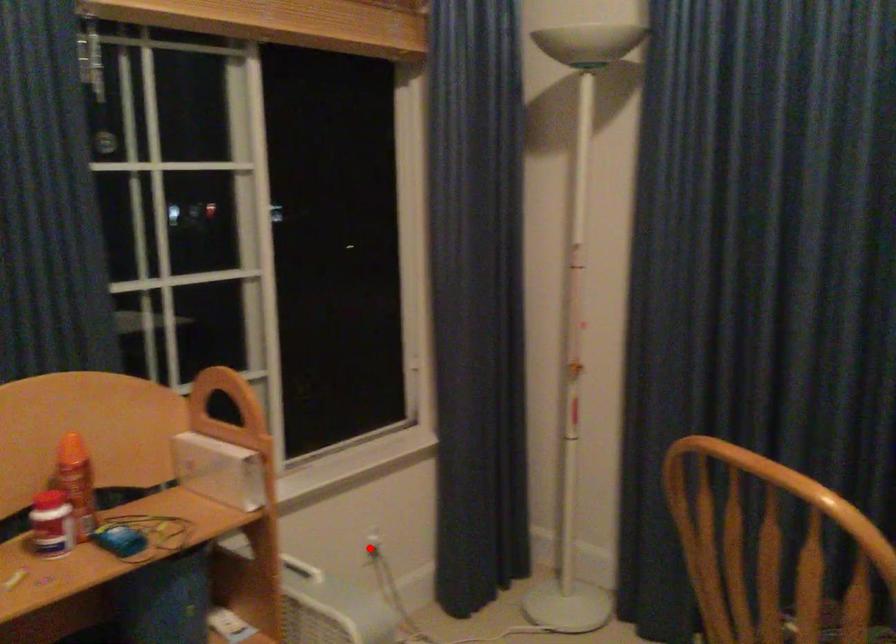
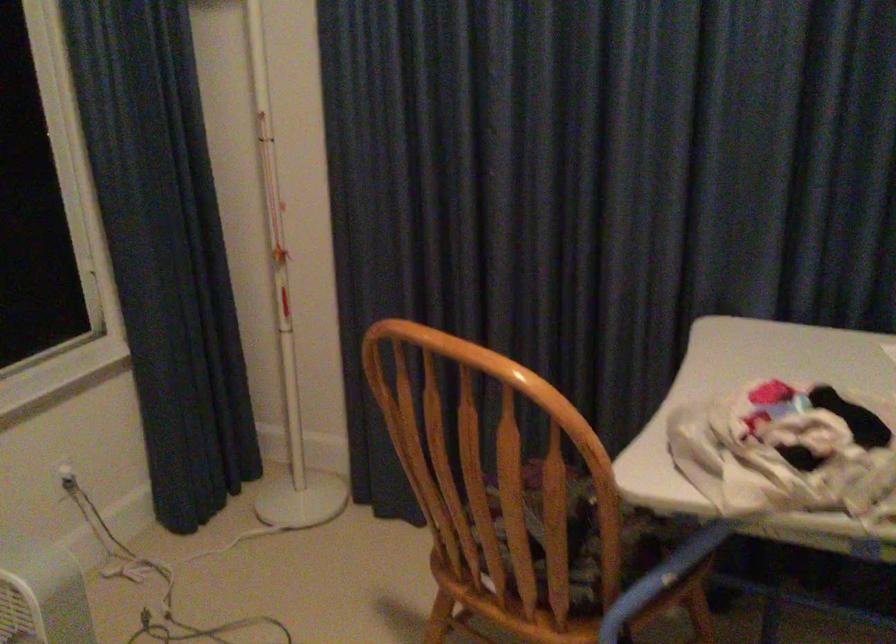
Question: I am providing you with two images of the same scene from different viewpoints. A red point is shown in image1. For the corresponding object point in image2, is it positioned nearer or farther from the camera?

Choices:
 (A) Nearer
 (B) Farther

Answer: (A)